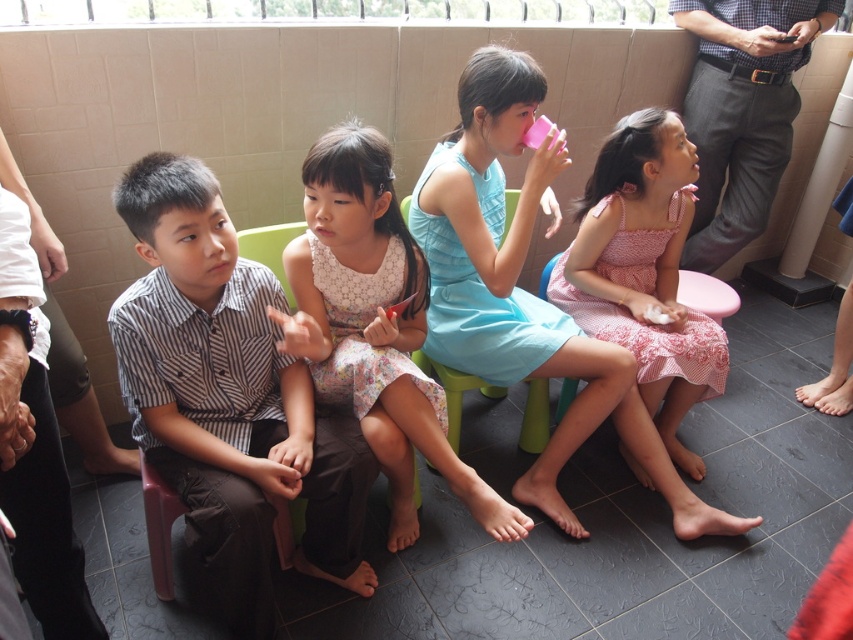
You are a photographer trying to capture a group photo of the children in the scene. You notice the pink cotton dress at center and the green plastic chair at center. Which object takes up more space in the photo?

The pink cotton dress at center has a larger size compared to the green plastic chair at center, so it takes up more space in the photo.

You are standing in the room where the children are sitting. You notice two points marked in the scene. Which point, point (344, 512) or point (459, 404), is closer to you?

Point (344, 512) is closer to the viewer than point (459, 404).